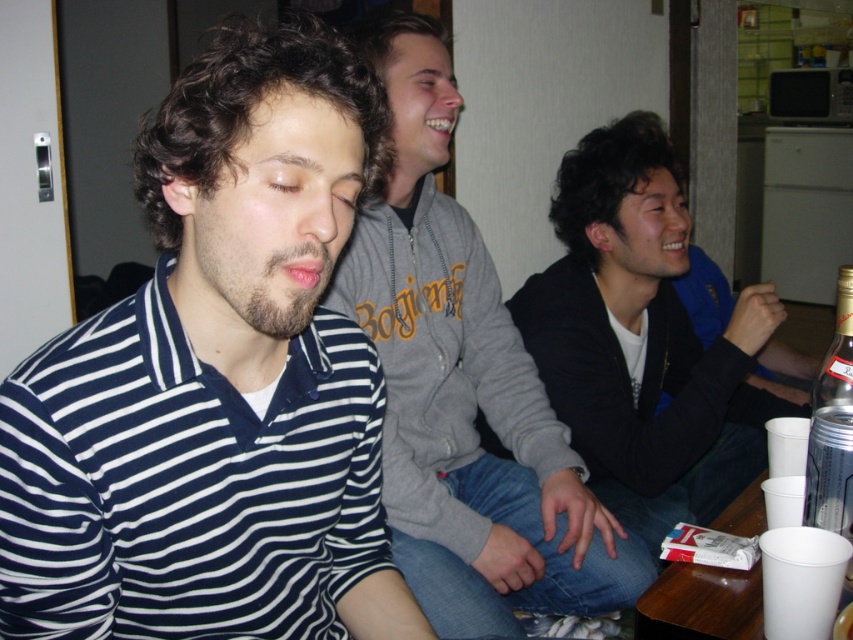
You are at a party and want to grab the white plastic cup at lower right without touching the gray fleece sweatshirt at center. Is this possible?

The gray fleece sweatshirt at center is located above the white plastic cup at lower right, so you can reach down to grab the white plastic cup at lower right without touching the gray fleece sweatshirt at center.

You are a photographer trying to capture a clear shot of the black matte jacket at center and the white plastic cup at lower right. Since you want both items in focus, which one should you adjust your camera focus on first to ensure the other is also in focus?

The black matte jacket at center is further to the viewer than the white plastic cup at lower right. To ensure both are in focus, focus on the black matte jacket at center first, as it is closer, and the white plastic cup at lower right will naturally fall into the depth of field.

Based on the scene description, what is located at the coordinates point (218,381)?

The striped cotton shirt at center is located at point (218,381).